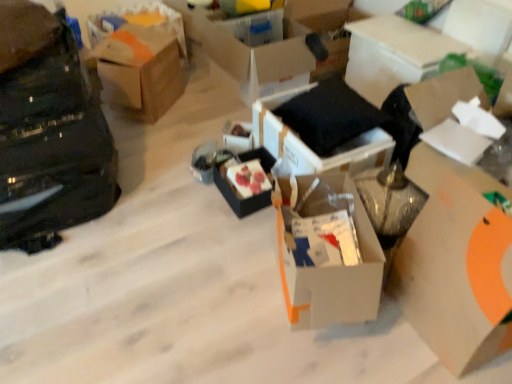
You are a GUI agent. You are given a task and a screenshot of the screen. Output one action in this format:
    pyautogui.click(x=<x>, y=<y>)
    Task: Click on the vacant area that lies between brown cardboard box at upper left, positioned as the first box in left-to-right order, and white cardboard box at center, the fifth box positioned from the right
    Image resolution: width=512 pixels, height=384 pixels.
    Given the screenshot: What is the action you would take?
    pyautogui.click(x=189, y=167)